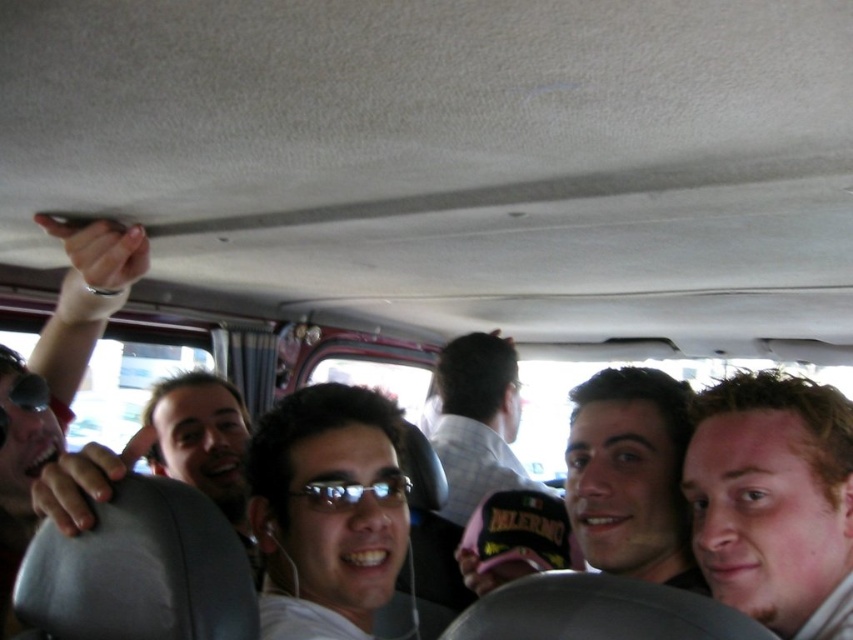
You are a photographer trying to capture a candid shot of the light brown hair at center and the matte black sunglasses at upper left. Which object should you zoom in on to ensure both are in focus?

The light brown hair at center is smaller than the matte black sunglasses at upper left, so you should zoom in on the light brown hair at center to ensure both are in focus.

Where is the light brown hair at center located in the image?

The light brown hair at center is located at the 2D coordinates point (772, 497) in the image.